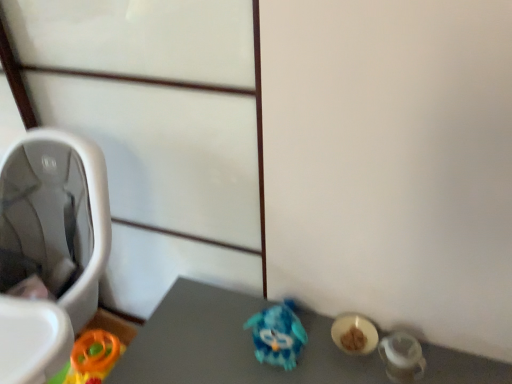
Locate an element on the screen. The width and height of the screenshot is (512, 384). vacant space that is to the left of blue plastic toy at center is located at coordinates (216, 346).